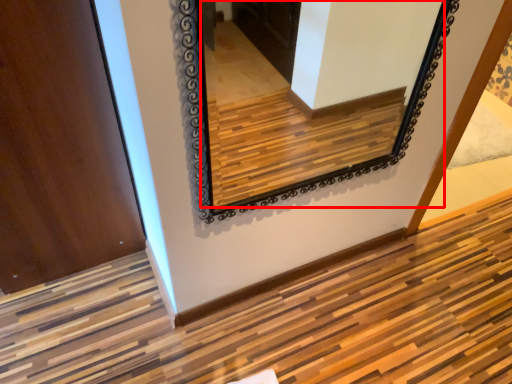
Question: Observing the image, what is the correct spatial positioning of mirror (annotated by the red box) in reference to door?

Choices:
 (A) left
 (B) right

Answer: (B)